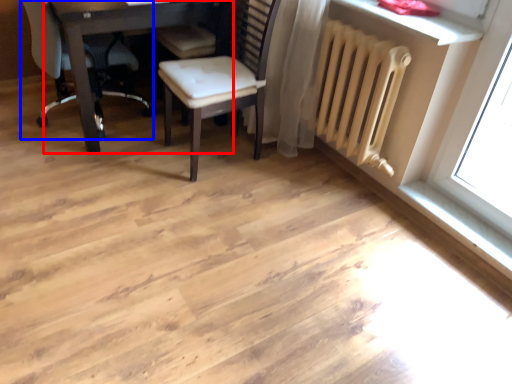
Question: Which point is closer to the camera, table (highlighted by a red box) or chair (highlighted by a blue box)?

Choices:
 (A) table
 (B) chair

Answer: (A)